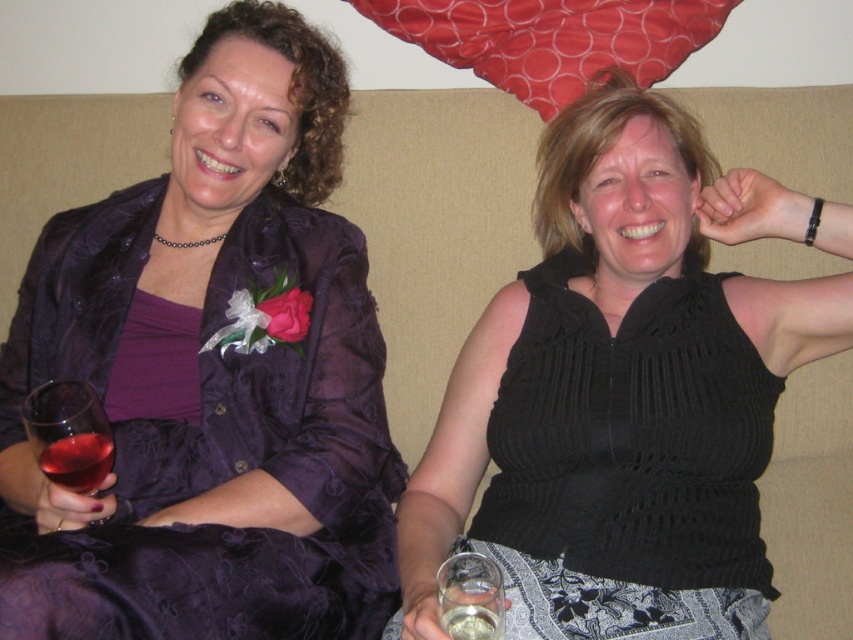
You are a photographer setting up a photo shoot. You need to position a microphone stand between the matte purple dress at center and the black knitted top at center so that it doesn t block either subject. Given their heights, which object should the microphone stand be placed closer to?

The microphone stand should be placed closer to the black knitted top at center because the matte purple dress at center is taller, so positioning the stand closer to the shorter object will ensure it doesn t block the view of the taller one.

You are a photographer taking a portrait of the two women on the beige couch. You want to ensure both the matte purple dress at center and the black knitted top at center are clearly visible in the photo. Which clothing item should you focus on first to ensure depth of field captures both?

You should focus on the matte purple dress at center first since it is closer to the viewer than the black knitted top at center. By focusing on the closer object, the depth of field will extend backward, potentially keeping both in focus.